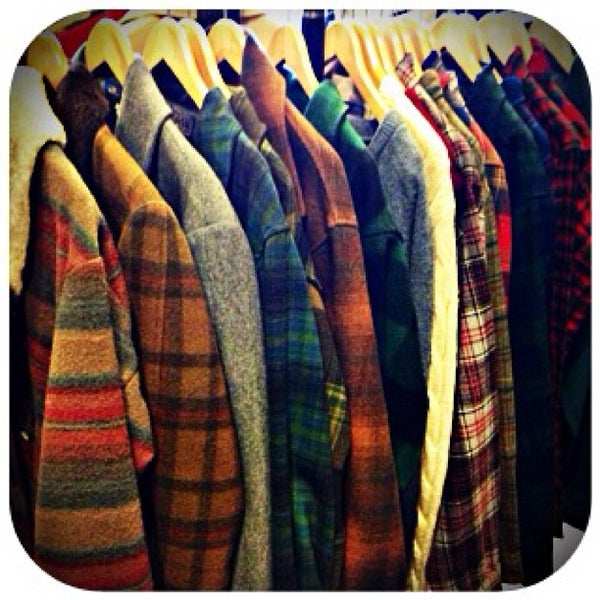
Where is `cloth hanger`? cloth hanger is located at coordinates (182, 58).